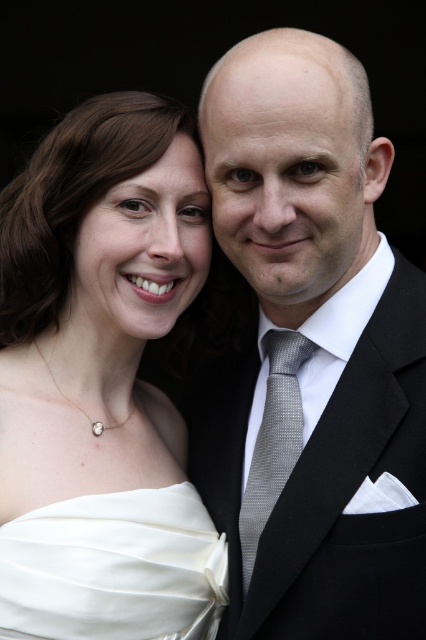
Question: Which object is positioned closest to the silver textured tie at center?

Choices:
 (A) white satin dress at left
 (B) satin white dress at lower left
 (C) matte silver tie at center

Answer: (C)

Question: Among these points, which one is farthest from the camera?

Choices:
 (A) (42, 609)
 (B) (293, 390)
 (C) (259, 355)

Answer: (C)

Question: Does white satin dress at left have a smaller size compared to satin white dress at lower left?

Choices:
 (A) no
 (B) yes

Answer: (A)

Question: Does matte silver tie at center appear over white satin dress at left?

Choices:
 (A) yes
 (B) no

Answer: (A)

Question: Which point is farther from the camera taking this photo?

Choices:
 (A) (313, 348)
 (B) (176, 445)

Answer: (B)

Question: In this image, where is matte silver tie at center located relative to silver textured tie at center?

Choices:
 (A) below
 (B) above

Answer: (B)